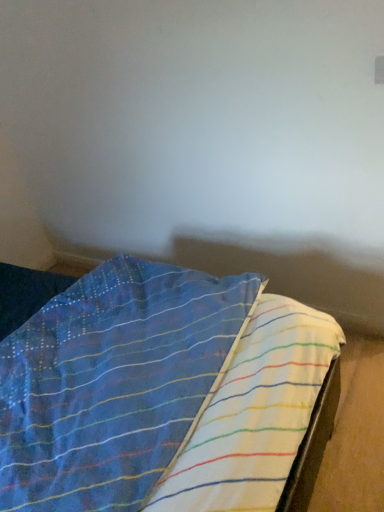
Identify the location of blue striped fabric at lower left. This screenshot has height=512, width=384. (159, 393).

The image size is (384, 512). Describe the element at coordinates (159, 393) in the screenshot. I see `blue striped fabric at lower left` at that location.

Locate an element on the screen. blue striped fabric at lower left is located at coordinates (159, 393).